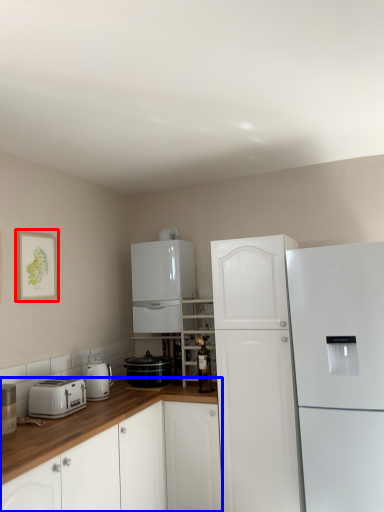
Question: Among these objects, which one is farthest to the camera, picture frame (highlighted by a red box) or cabinetry (highlighted by a blue box)?

Choices:
 (A) picture frame
 (B) cabinetry

Answer: (A)